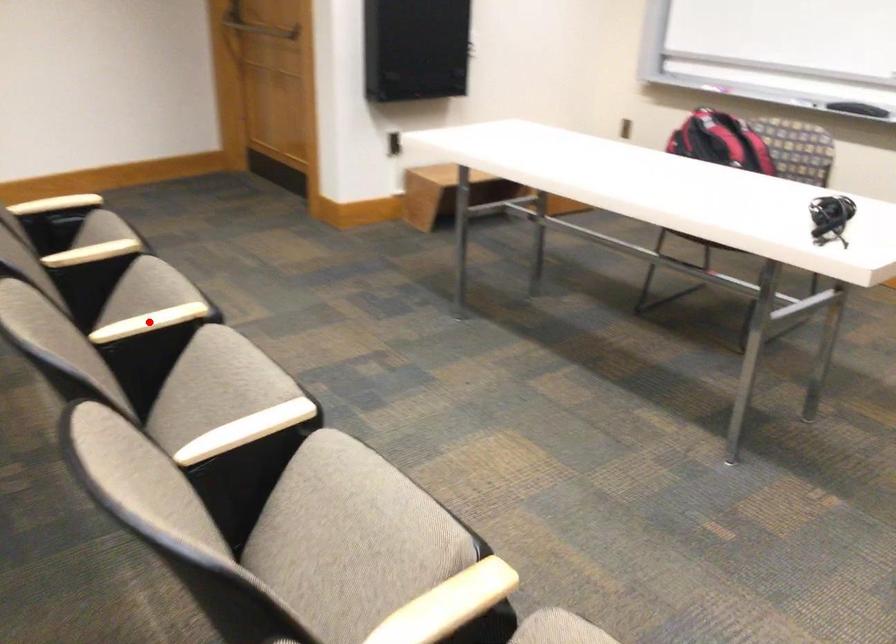
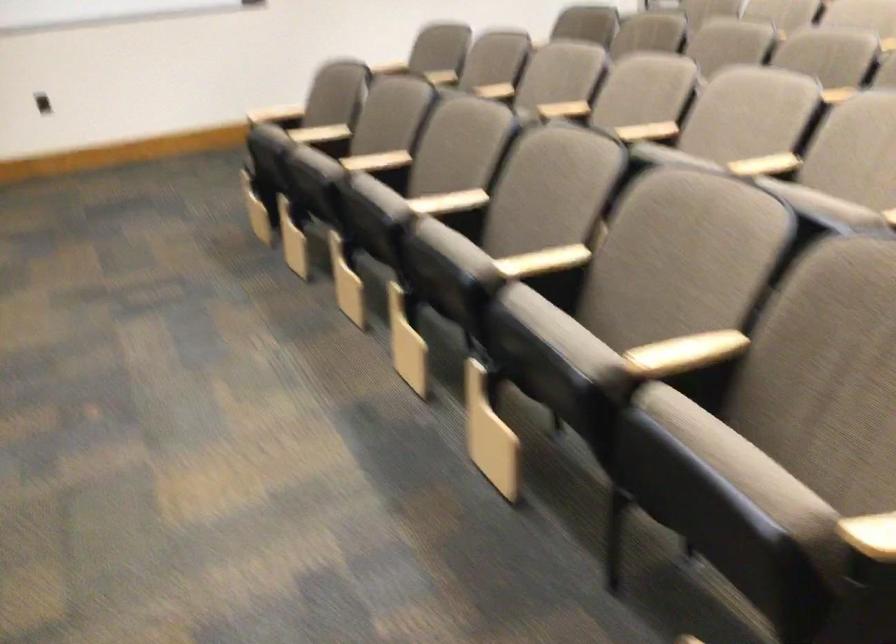
Question: I am providing you with two images of the same scene from different viewpoints. A red point is marked on the first image. Is the red point's position out of view in image 2?

Choices:
 (A) Yes
 (B) No

Answer: (A)